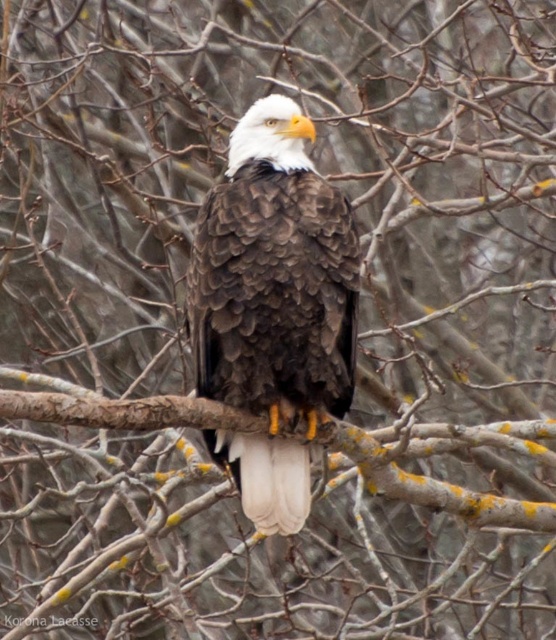
Which of these two, dark brown feathers at center or brown rough tree branch at center, stands taller?

dark brown feathers at center

Is dark brown feathers at center taller than brown rough tree branch at center?

Yes, dark brown feathers at center is taller than brown rough tree branch at center.

Is point (350, 307) positioned behind point (480, 440)?

No, it is not.

Locate an element on the screen. This screenshot has height=640, width=556. dark brown feathers at center is located at coordinates (272, 307).